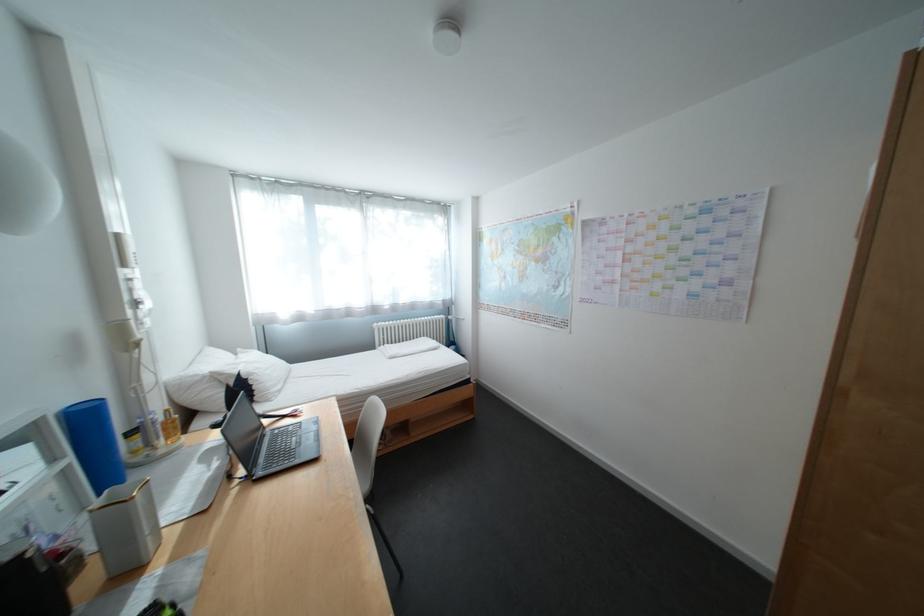
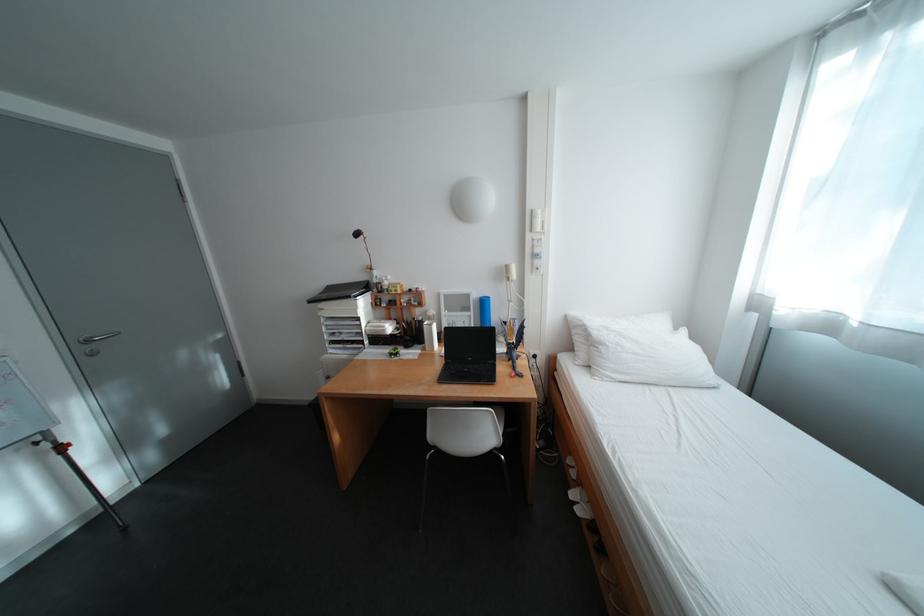
Locate, in the second image, the point that corresponds to the point at 129,237 in the first image.

(544, 213)